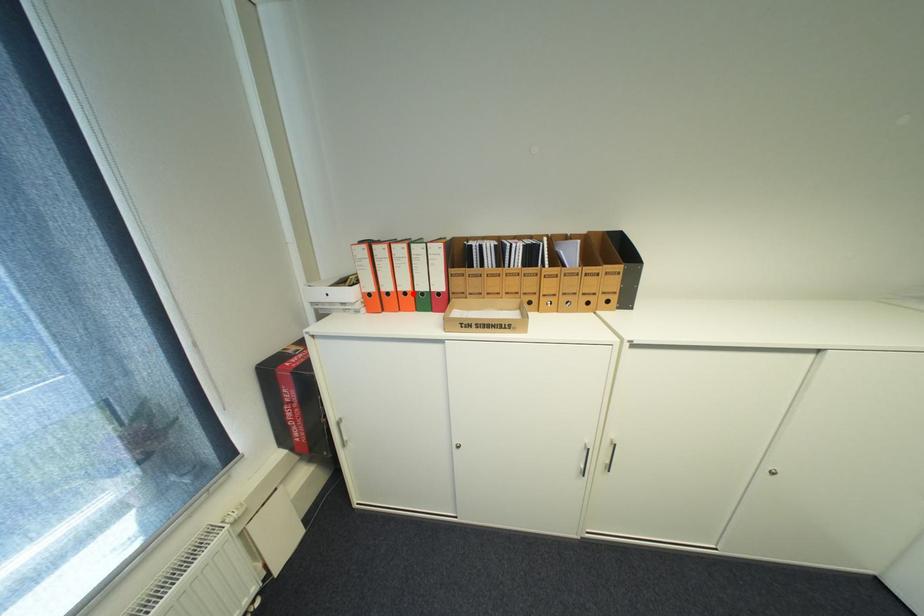
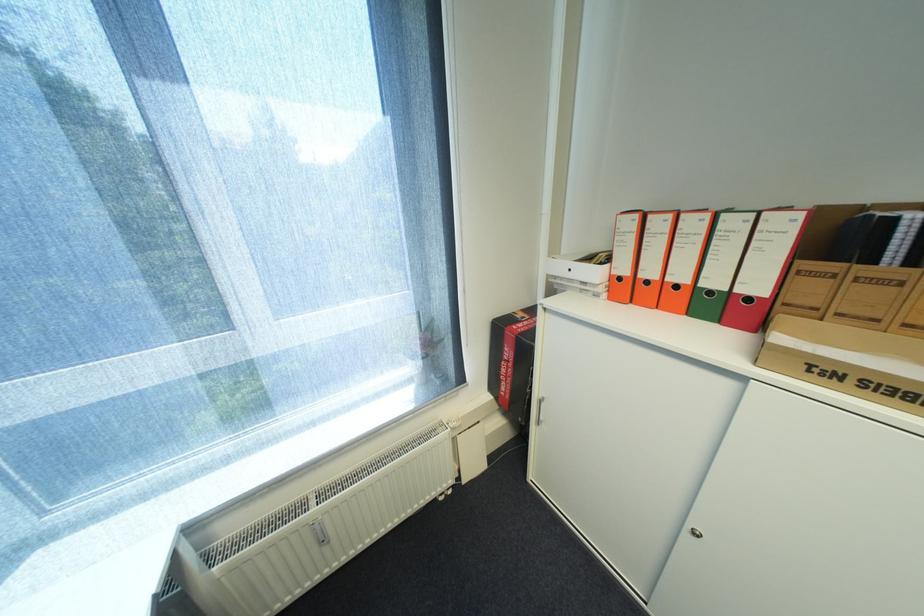
Find the pixel in the second image that matches the highlighted location in the first image.

(685, 286)